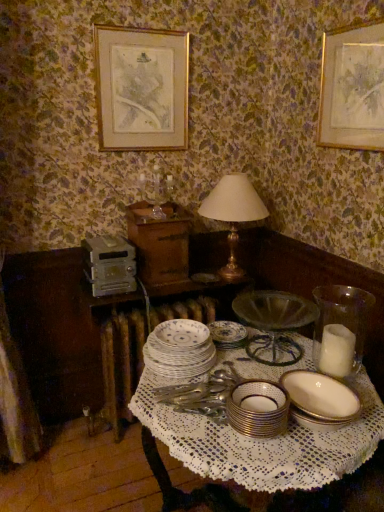
Where is `gold-framed print at upper center`? Image resolution: width=384 pixels, height=512 pixels. gold-framed print at upper center is located at coordinates [x=141, y=89].

At what (x,y) coordinates should I click in order to perform the action: click on clear glass candle holder at upper center. Please return your answer as a coordinate pair (x, y). The width and height of the screenshot is (384, 512). Looking at the image, I should click on (156, 190).

What is the approximate height of white glass candle at right, which ranks as the first tableware in right-to-left order?

9.13 inches.

Where is `white glass candle at right, which ranks as the first tableware in right-to-left order`? The height and width of the screenshot is (512, 384). white glass candle at right, which ranks as the first tableware in right-to-left order is located at coordinates (340, 329).

Locate an element on the screen. This screenshot has width=384, height=512. gold metallic table lamp at center is located at coordinates (233, 214).

Does point (125, 132) lie behind point (102, 366)?

No, (125, 132) is in front of (102, 366).

From the picture: From a real-world perspective, which is physically below, gold-framed print at upper center or white porcelain table at center?

In real-world perspective, white porcelain table at center is lower.

Does gold-framed print at upper center turn towards white porcelain table at center?

No, gold-framed print at upper center is not aimed at white porcelain table at center.

Is gold-framed print at upper center shorter than white porcelain table at center?

Indeed, gold-framed print at upper center has a lesser height compared to white porcelain table at center.

In the scene shown: Which point is more distant from viewer, (182, 429) or (158, 169)?

The point (158, 169) is more distant.

Measure the distance from white porcelain table at center to clear glass candle holder at upper center.

They are 3.47 feet apart.

Does white porcelain table at center have a greater height compared to clear glass candle holder at upper center?

Yes.

Can you confirm if white porcelain table at center is bigger than clear glass candle holder at upper center?

Yes, white porcelain table at center is bigger than clear glass candle holder at upper center.

Is gold-framed print at upper center located outside porcelain plate at center?

Absolutely, gold-framed print at upper center is external to porcelain plate at center.

How much distance is there between gold-framed print at upper center and porcelain plate at center?

gold-framed print at upper center is 3.65 feet away from porcelain plate at center.

Considering the positions of point (150, 96) and point (193, 327), is point (150, 96) closer or farther from the camera than point (193, 327)?

Point (150, 96) is positioned farther from the camera compared to point (193, 327).

Is white porcelain plates at center, placed as the first tableware when sorted from back to front, thinner than clear glass candle holder at upper center?

In fact, white porcelain plates at center, placed as the first tableware when sorted from back to front, might be wider than clear glass candle holder at upper center.

Could you tell me if white porcelain plates at center, placed as the first tableware when sorted from back to front, is facing clear glass candle holder at upper center?

No, white porcelain plates at center, placed as the first tableware when sorted from back to front, is not aimed at clear glass candle holder at upper center.

Locate an element on the screen. the 1st tableware counting from the right of the clear glass candle holder at upper center is located at coordinates (179, 349).

From a real-world perspective, is white porcelain plates at center, which is the 3th tableware in front-to-back order, beneath clear glass candle holder at upper center?

Yes, from a real-world perspective, white porcelain plates at center, which is the 3th tableware in front-to-back order, is beneath clear glass candle holder at upper center.

Is gold metallic bowl at center, which is the 2th tableware in right-to-left order, shorter than gold-framed print at upper center?

Indeed, gold metallic bowl at center, which is the 2th tableware in right-to-left order, has a lesser height compared to gold-framed print at upper center.

Is gold metallic bowl at center, acting as the third tableware starting from the back, smaller than gold-framed print at upper center?

Correct, gold metallic bowl at center, acting as the third tableware starting from the back, occupies less space than gold-framed print at upper center.

From the image's perspective, which is below, gold metallic bowl at center, which ranks as the 2th tableware in left-to-right order, or gold-framed print at upper center?

From the image's view, gold metallic bowl at center, which ranks as the 2th tableware in left-to-right order, is below.

Is point (358, 441) less distant than point (108, 79)?

That is True.

Who is shorter, white porcelain table at center or gold-framed print at upper center?

gold-framed print at upper center.

From the picture: From the image's perspective, is white porcelain table at center located above gold-framed print at upper center?

No, from the image's perspective, white porcelain table at center is not above gold-framed print at upper center.

Does white porcelain table at center have a greater width compared to gold-framed print at upper center?

Yes.

From a real-world perspective, who is located lower, porcelain plate at center or gold metallic bowl at center, which ranks as the 2th tableware in left-to-right order?

In real-world perspective, gold metallic bowl at center, which ranks as the 2th tableware in left-to-right order, is lower.

From the picture: How different are the orientations of porcelain plate at center and gold metallic bowl at center, which ranks as the 2th tableware in left-to-right order, in degrees?

0.0025 degrees separate the facing orientations of porcelain plate at center and gold metallic bowl at center, which ranks as the 2th tableware in left-to-right order.

Considering the sizes of objects porcelain plate at center and gold metallic bowl at center, marked as the 1th tableware in a front-to-back arrangement, in the image provided, who is bigger, porcelain plate at center or gold metallic bowl at center, marked as the 1th tableware in a front-to-back arrangement,?

With larger size is gold metallic bowl at center, marked as the 1th tableware in a front-to-back arrangement.

Is point (168, 333) less distant than point (234, 421)?

No, (168, 333) is behind (234, 421).

Where is `table that is behind the gold-framed print at upper center`? table that is behind the gold-framed print at upper center is located at coordinates (147, 332).

There is a white porcelain table at center. Identify the location of candle holder above it (from a real-world perspective). (156, 190).

Considering their positions, is clear glass candle holder at upper center positioned closer to white porcelain table at center than gold metallic bowl at center, acting as the third tableware starting from the back?

The object closer to white porcelain table at center is gold metallic bowl at center, acting as the third tableware starting from the back.

Which object lies further to the anchor point clear glass candle holder at upper center, white porcelain table at center or gold-framed print at upper center?

The object further to clear glass candle holder at upper center is white porcelain table at center.

Estimate the real-world distances between objects in this image. Which object is closer to gold metallic bowl at center, acting as the third tableware starting from the back, white porcelain table at center or white glass candle at right, acting as the third tableware starting from the left?

white porcelain table at center is positioned closer to the anchor gold metallic bowl at center, acting as the third tableware starting from the back.

Estimate the real-world distances between objects in this image. Which object is further from gold-framed print at upper center, white porcelain table at center or white glass candle at right, acting as the third tableware starting from the left?

Based on the image, white glass candle at right, acting as the third tableware starting from the left, appears to be further to gold-framed print at upper center.

Estimate the real-world distances between objects in this image. Which object is further from white porcelain plates at center, which is the 3th tableware in front-to-back order, white porcelain table at center or white glass candle at right, acting as the third tableware starting from the left?

white glass candle at right, acting as the third tableware starting from the left.

Looking at this image, when comparing their distances from gold metallic bowl at center, acting as the third tableware starting from the back, does porcelain plate at center or white porcelain table at center seem closer?

white porcelain table at center is positioned closer to the anchor gold metallic bowl at center, acting as the third tableware starting from the back.

Based on their spatial positions, is porcelain plate at center or white glass candle at right, which ranks as the 2th tableware in back-to-front order, closer to clear glass candle holder at upper center?

The object closer to clear glass candle holder at upper center is porcelain plate at center.

Which object lies nearer to the anchor point gold metallic table lamp at center, clear glass candle holder at upper center or porcelain plate at center?

The object closer to gold metallic table lamp at center is clear glass candle holder at upper center.

You are a GUI agent. You are given a task and a screenshot of the screen. Output one action in this format:
    pyautogui.click(x=<x>, y=<y>)
    Task: Click on the platter between clear glass candle holder at upper center and white porcelain table at center in the vertical direction
    Image resolution: width=384 pixels, height=512 pixels.
    Given the screenshot: What is the action you would take?
    pyautogui.click(x=180, y=335)

I want to click on table lamp between gold-framed print at upper center and white glass candle at right, which ranks as the 2th tableware in back-to-front order, in the vertical direction, so click(x=233, y=214).

The width and height of the screenshot is (384, 512). Identify the location of table between white porcelain table at center and clear glass candle holder at upper center along the z-axis. (147, 332).

Where is `platter between white porcelain plates at center, which is counted as the 1th tableware, starting from the left, and white porcelain table at center from front to back`? platter between white porcelain plates at center, which is counted as the 1th tableware, starting from the left, and white porcelain table at center from front to back is located at coordinates (180, 335).